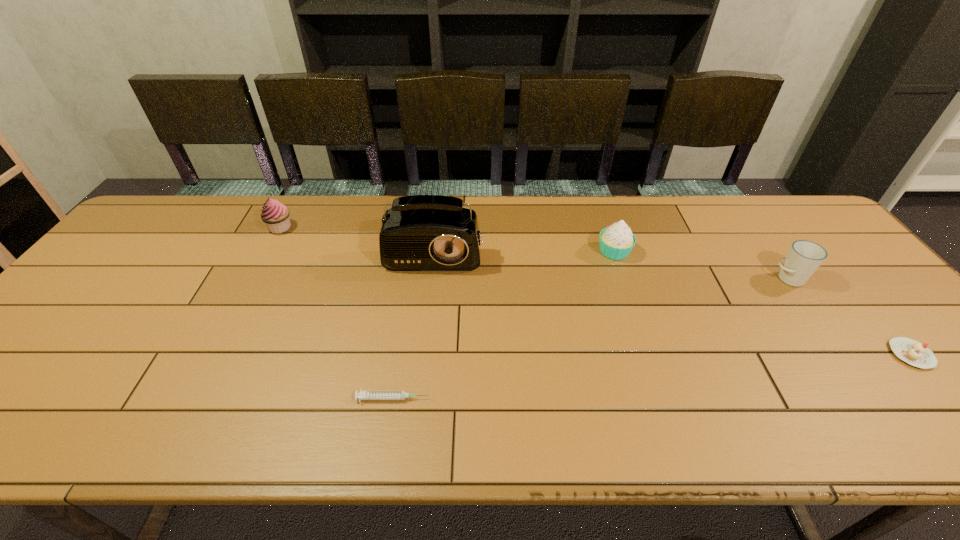
Locate an element on the screen. free region at the far edge is located at coordinates (742, 231).

In the image, there is a desktop. At what (x,y) coordinates should I click in order to perform the action: click on vacant region at the near edge. Please return your answer as a coordinate pair (x, y). Looking at the image, I should click on (590, 430).

Find the location of `blank space at the left edge of the desktop`. blank space at the left edge of the desktop is located at coordinates (48, 366).

You are a GUI agent. You are given a task and a screenshot of the screen. Output one action in this format:
    pyautogui.click(x=<x>, y=<y>)
    Task: Click on the vacant space at the right edge
    
    Given the screenshot: What is the action you would take?
    pos(888,379)

Locate an element on the screen. The width and height of the screenshot is (960, 540). free space at the far left corner is located at coordinates (144, 239).

Where is `free space between the radio receiver and the nearest cupcake`? The width and height of the screenshot is (960, 540). free space between the radio receiver and the nearest cupcake is located at coordinates (674, 297).

I want to click on vacant space that's between the nearest object and the leftmost cupcake, so click(337, 313).

Where is `free point between the second nearest object and the fifth object from left to right`? free point between the second nearest object and the fifth object from left to right is located at coordinates click(850, 316).

You are a GUI agent. You are given a task and a screenshot of the screen. Output one action in this format:
    pyautogui.click(x=<x>, y=<y>)
    Task: Click on the free space between the radio receiver and the second cupcake from left to right
    
    Given the screenshot: What is the action you would take?
    click(x=525, y=246)

I want to click on unoccupied position between the nearest cupcake and the radio receiver, so coord(674,297).